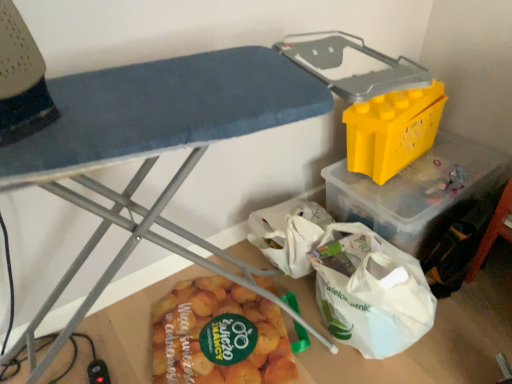
Question: Considering the relative positions of yellow plastic storage bin at upper right and yellow plastic container at upper right in the image provided, is yellow plastic storage bin at upper right to the right of yellow plastic container at upper right from the viewer's perspective?

Choices:
 (A) no
 (B) yes

Answer: (A)

Question: Is yellow plastic storage bin at upper right oriented away from yellow plastic container at upper right?

Choices:
 (A) no
 (B) yes

Answer: (A)

Question: Is the depth of yellow plastic storage bin at upper right greater than that of yellow plastic container at upper right?

Choices:
 (A) yes
 (B) no

Answer: (B)

Question: Is yellow plastic storage bin at upper right located outside yellow plastic container at upper right?

Choices:
 (A) no
 (B) yes

Answer: (B)

Question: Does yellow plastic storage bin at upper right have a larger size compared to yellow plastic container at upper right?

Choices:
 (A) no
 (B) yes

Answer: (B)

Question: Considering the positions of yellow plastic container at upper right and yellow plastic storage bin at upper right in the image, is yellow plastic container at upper right bigger or smaller than yellow plastic storage bin at upper right?

Choices:
 (A) small
 (B) big

Answer: (A)

Question: Is yellow plastic container at upper right in front of or behind yellow plastic storage bin at upper right in the image?

Choices:
 (A) behind
 (B) front

Answer: (A)

Question: Would you say yellow plastic container at upper right is to the left or to the right of yellow plastic storage bin at upper right in the picture?

Choices:
 (A) left
 (B) right

Answer: (B)

Question: Do you think yellow plastic container at upper right is within yellow plastic storage bin at upper right, or outside of it?

Choices:
 (A) outside
 (B) inside

Answer: (A)

Question: Considering the relative positions of yellow plastic storage bin at upper right and yellow plastic container at upper right in the image provided, is yellow plastic storage bin at upper right to the left or to the right of yellow plastic container at upper right?

Choices:
 (A) left
 (B) right

Answer: (A)

Question: Which is correct: yellow plastic storage bin at upper right is inside yellow plastic container at upper right, or outside of it?

Choices:
 (A) outside
 (B) inside

Answer: (A)

Question: From a real-world perspective, is yellow plastic storage bin at upper right positioned above or below yellow plastic container at upper right?

Choices:
 (A) below
 (B) above

Answer: (B)

Question: Looking at their shapes, would you say yellow plastic storage bin at upper right is wider or thinner than yellow plastic container at upper right?

Choices:
 (A) wide
 (B) thin

Answer: (A)

Question: From the image's perspective, is yellow matte potato at lower center positioned above or below yellow plastic storage bin at upper right?

Choices:
 (A) below
 (B) above

Answer: (A)

Question: Does point (227, 286) appear closer or farther from the camera than point (176, 110)?

Choices:
 (A) closer
 (B) farther

Answer: (B)